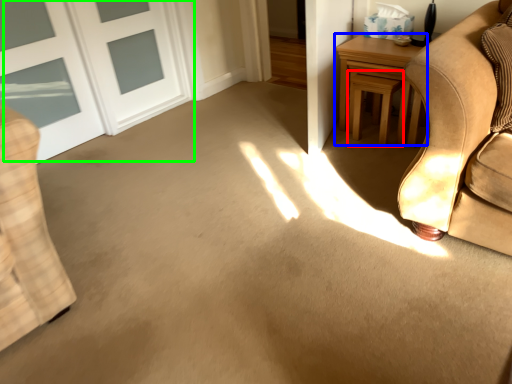
Question: Considering the real-world distances, which object is closest to stool (highlighted by a red box)? table (highlighted by a blue box) or door (highlighted by a green box).

Choices:
 (A) table
 (B) door

Answer: (A)